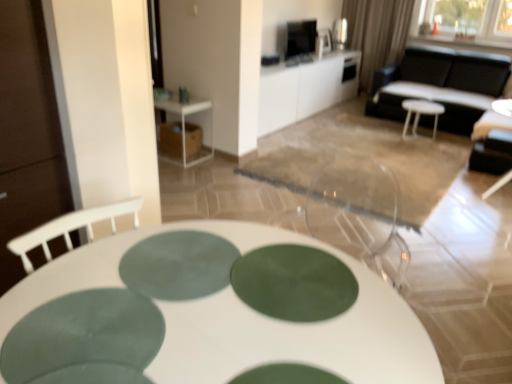
What do you see at coordinates (440, 85) in the screenshot? This screenshot has width=512, height=384. I see `black leather couch at upper right` at bounding box center [440, 85].

Find the location of a particular element. The width and height of the screenshot is (512, 384). black leather chair at right is located at coordinates (503, 107).

Image resolution: width=512 pixels, height=384 pixels. Identify the location of green fabric curtain at upper right. (377, 33).

Where is `white plastic side table at upper left, which is the 2th table from bottom to top`? white plastic side table at upper left, which is the 2th table from bottom to top is located at coordinates (184, 125).

The width and height of the screenshot is (512, 384). Describe the element at coordinates (184, 125) in the screenshot. I see `white plastic side table at upper left, which is the 2th table from bottom to top` at that location.

I want to click on white glossy cabinet at upper center, which is the third table from bottom to top, so click(x=305, y=89).

Where is `black leather couch at upper right`? Image resolution: width=512 pixels, height=384 pixels. black leather couch at upper right is located at coordinates pyautogui.click(x=440, y=85).

Looking at this image, considering the relative sizes of green fabric curtain at upper right and white plastic stool at center in the image provided, is green fabric curtain at upper right taller than white plastic stool at center?

Indeed, green fabric curtain at upper right has a greater height compared to white plastic stool at center.

Who is smaller, green fabric curtain at upper right or white plastic stool at center?

Smaller between the two is white plastic stool at center.

Does green fabric curtain at upper right appear on the right side of white plastic stool at center?

No.

What's the angular difference between green fabric curtain at upper right and white plastic stool at center's facing directions?

0.000148 degrees.

Considering the points (144, 271) and (406, 25), which point is in front, point (144, 271) or point (406, 25)?

The point (144, 271) is more forward.

Consider the image. From a real-world perspective, who is located higher, green matte placemat at center or green fabric curtain at upper right?

green matte placemat at center, from a real-world perspective.

Is green matte placemat at center bigger or smaller than green fabric curtain at upper right?

Clearly, green matte placemat at center is smaller in size than green fabric curtain at upper right.

Considering the sizes of black leather couch at upper right and white plastic side table at upper left, acting as the second table starting from the back, in the image, is black leather couch at upper right wider or thinner than white plastic side table at upper left, acting as the second table starting from the back,?

Considering their sizes, black leather couch at upper right looks broader than white plastic side table at upper left, acting as the second table starting from the back.

Consider the image. Can you confirm if black leather couch at upper right is bigger than white plastic side table at upper left, which is the 2th table from bottom to top?

Correct, black leather couch at upper right is larger in size than white plastic side table at upper left, which is the 2th table from bottom to top.

Could you tell me if black leather couch at upper right is turned towards white plastic side table at upper left, the second table in the top-to-bottom sequence?

Yes, black leather couch at upper right is aimed at white plastic side table at upper left, the second table in the top-to-bottom sequence.

Which of these two, white plastic stool at center or white glossy cabinet at upper center, which is the third table from bottom to top, is thinner?

white plastic stool at center is thinner.

How different are the orientations of white plastic stool at center and white glossy cabinet at upper center, marked as the first table in a back-to-front arrangement, in degrees?

There is a 90-degree angle between the facing directions of white plastic stool at center and white glossy cabinet at upper center, marked as the first table in a back-to-front arrangement.

Is white plastic stool at center in front of or behind white glossy cabinet at upper center, marked as the 3th table in a front-to-back arrangement, in the image?

Clearly, white plastic stool at center is behind white glossy cabinet at upper center, marked as the 3th table in a front-to-back arrangement.

Is white plastic stool at center positioned with its back to white glossy cabinet at upper center, marked as the 3th table in a front-to-back arrangement?

No, white plastic stool at center is not facing away from white glossy cabinet at upper center, marked as the 3th table in a front-to-back arrangement.

Who is bigger, white glossy table at center, arranged as the third table when viewed from the back, or green matte placemat at center?

white glossy table at center, arranged as the third table when viewed from the back.

Which is correct: white glossy table at center, positioned as the 3th table in top-to-bottom order, is inside green matte placemat at center, or outside of it?

The correct answer is: outside.

From a real-world perspective, is white glossy table at center, which is the 1th table from bottom to top, located higher than green matte placemat at center?

Incorrect, from a real-world perspective, white glossy table at center, which is the 1th table from bottom to top, is lower than green matte placemat at center.

From a real-world perspective, is black leather chair at right positioned over white plastic side table at upper left, which is the 2th table in front-to-back order, based on gravity?

Yes, from a real-world perspective, black leather chair at right is above white plastic side table at upper left, which is the 2th table in front-to-back order.

Identify the location of the 1st table positioned above the black leather chair at right (from the image's perspective). The image size is (512, 384). 184,125.

Is white plastic side table at upper left, which is the 2th table in front-to-back order, inside black leather chair at right?

Actually, white plastic side table at upper left, which is the 2th table in front-to-back order, is outside black leather chair at right.

Considering the sizes of objects black leather chair at right and white plastic side table at upper left, which is the 2th table from bottom to top, in the image provided, who is smaller, black leather chair at right or white plastic side table at upper left, which is the 2th table from bottom to top,?

white plastic side table at upper left, which is the 2th table from bottom to top.

Locate an element on the screen. This screenshot has height=384, width=512. table above the black leather couch at upper right (from the image's perspective) is located at coordinates (305, 89).

How distant is white glossy cabinet at upper center, arranged as the first table when viewed from the top, from black leather couch at upper right?

white glossy cabinet at upper center, arranged as the first table when viewed from the top, is 1.24 meters from black leather couch at upper right.

Considering the points (272, 117) and (404, 56), which point is in front, point (272, 117) or point (404, 56)?

The point (272, 117) is closer to the camera.

Based on their sizes in the image, would you say white glossy cabinet at upper center, arranged as the first table when viewed from the top, is bigger or smaller than black leather couch at upper right?

In the image, white glossy cabinet at upper center, arranged as the first table when viewed from the top, appears to be smaller than black leather couch at upper right.

Locate an element on the screen. The height and width of the screenshot is (384, 512). curtain behind the white plastic stool at center is located at coordinates (377, 33).

This screenshot has height=384, width=512. In the image, there is a green matte placemat at center. Identify the location of curtain above it (from the image's perspective). (377, 33).

From the image, which object appears to be farther from white plastic stool at center, black leather chair at right or green fabric curtain at upper right?

The object further to white plastic stool at center is green fabric curtain at upper right.

Considering their positions, is green matte placemat at center positioned further to white glossy cabinet at upper center, arranged as the first table when viewed from the top, than white glossy table at center, arranged as the third table when viewed from the back?

Among the two, white glossy table at center, arranged as the third table when viewed from the back, is located further to white glossy cabinet at upper center, arranged as the first table when viewed from the top.

Looking at the image, which one is located further to green matte placemat at center, white glossy cabinet at upper center, marked as the 3th table in a front-to-back arrangement, or green fabric curtain at upper right?

green fabric curtain at upper right is further to green matte placemat at center.

From the image, which object appears to be farther from black leather chair at right, black leather couch at upper right or white glossy table at center, positioned as the 3th table in top-to-bottom order?

The object further to black leather chair at right is white glossy table at center, positioned as the 3th table in top-to-bottom order.

Which object lies further to the anchor point black leather chair at right, white plastic stool at center or white plastic side table at upper left, which is the 2th table in front-to-back order?

white plastic side table at upper left, which is the 2th table in front-to-back order.

When comparing their distances from white glossy cabinet at upper center, marked as the 3th table in a front-to-back arrangement, does green matte placemat at center or black leather chair at right seem further?

Among the two, green matte placemat at center is located further to white glossy cabinet at upper center, marked as the 3th table in a front-to-back arrangement.

Looking at the image, which one is located closer to green matte placemat at center, green fabric curtain at upper right or white plastic stool at center?

white plastic stool at center is positioned closer to the anchor green matte placemat at center.

Based on their spatial positions, is white glossy table at center, positioned as the 3th table in top-to-bottom order, or white plastic side table at upper left, which is the 2th table from bottom to top, further from green matte placemat at center?

white plastic side table at upper left, which is the 2th table from bottom to top, is positioned further to the anchor green matte placemat at center.

The image size is (512, 384). In order to click on side table between black leather chair at right and black leather couch at upper right from front to back in this screenshot , I will do `click(419, 115)`.

Image resolution: width=512 pixels, height=384 pixels. Find the location of `curtain between white plastic side table at upper left, which is the 2th table from bottom to top, and black leather couch at upper right from left to right`. curtain between white plastic side table at upper left, which is the 2th table from bottom to top, and black leather couch at upper right from left to right is located at coordinates (377, 33).

This screenshot has width=512, height=384. Find the location of `oval located between white glossy table at center, positioned as the 3th table in top-to-bottom order, and white plastic stool at center in the depth direction`. oval located between white glossy table at center, positioned as the 3th table in top-to-bottom order, and white plastic stool at center in the depth direction is located at coordinates (178, 265).

Where is `couch positioned between green matte placemat at center and green fabric curtain at upper right from near to far`? couch positioned between green matte placemat at center and green fabric curtain at upper right from near to far is located at coordinates (440, 85).